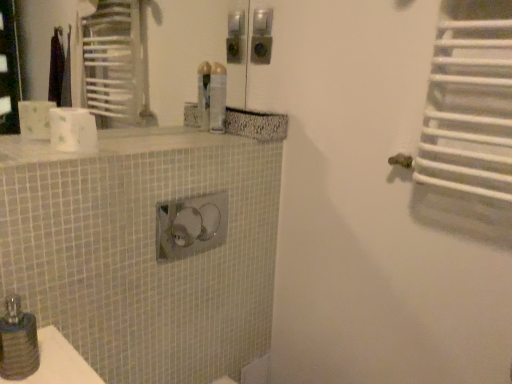
Question: Is white matte toilet paper at upper left in contact with white mosaic tile counter top at upper center?

Choices:
 (A) yes
 (B) no

Answer: (B)

Question: Does white matte toilet paper at upper left come behind white mosaic tile counter top at upper center?

Choices:
 (A) no
 (B) yes

Answer: (B)

Question: Is white matte toilet paper at upper left at the left side of white mosaic tile counter top at upper center?

Choices:
 (A) yes
 (B) no

Answer: (A)

Question: Is white matte toilet paper at upper left bigger than white mosaic tile counter top at upper center?

Choices:
 (A) yes
 (B) no

Answer: (B)

Question: Is white matte toilet paper at upper left in front of white mosaic tile counter top at upper center?

Choices:
 (A) no
 (B) yes

Answer: (A)

Question: Does white matte toilet paper at upper left have a lesser height compared to white mosaic tile counter top at upper center?

Choices:
 (A) yes
 (B) no

Answer: (B)

Question: Could you tell me if matte black soap dispenser at lower left is turned towards white mosaic tile counter top at upper center?

Choices:
 (A) no
 (B) yes

Answer: (A)

Question: Considering the relative positions of matte black soap dispenser at lower left and white mosaic tile counter top at upper center in the image provided, is matte black soap dispenser at lower left in front of white mosaic tile counter top at upper center?

Choices:
 (A) no
 (B) yes

Answer: (B)

Question: From a real-world perspective, is matte black soap dispenser at lower left located beneath white mosaic tile counter top at upper center?

Choices:
 (A) yes
 (B) no

Answer: (A)

Question: Is there a large distance between matte black soap dispenser at lower left and white mosaic tile counter top at upper center?

Choices:
 (A) no
 (B) yes

Answer: (A)

Question: Does matte black soap dispenser at lower left appear on the left side of white mosaic tile counter top at upper center?

Choices:
 (A) no
 (B) yes

Answer: (B)

Question: Is white mosaic tile counter top at upper center located within matte black soap dispenser at lower left?

Choices:
 (A) no
 (B) yes

Answer: (A)

Question: Is white matte toilet paper at upper left next to translucent plastic spray can at upper center?

Choices:
 (A) yes
 (B) no

Answer: (B)